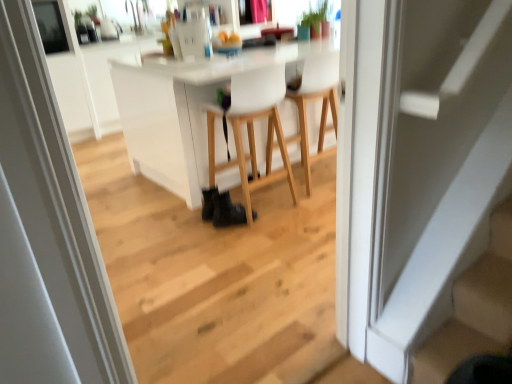
Find the location of a particular element. white matte chair at center, the second chair viewed from the right is located at coordinates (249, 142).

The image size is (512, 384). Describe the element at coordinates (47, 233) in the screenshot. I see `white glossy door at center` at that location.

Find the location of a particular element. The image size is (512, 384). white glossy door at center is located at coordinates (47, 233).

You are a GUI agent. You are given a task and a screenshot of the screen. Output one action in this format:
    pyautogui.click(x=<x>, y=<y>)
    Task: Click on the white matte chair at center, acting as the second chair starting from the left
    Image resolution: width=512 pixels, height=384 pixels.
    Given the screenshot: What is the action you would take?
    pyautogui.click(x=322, y=106)

The height and width of the screenshot is (384, 512). Describe the element at coordinates (474, 308) in the screenshot. I see `white matte stair at lower right` at that location.

In order to click on white matte chair at center, the second chair viewed from the right in this screenshot , I will do `click(249, 142)`.

Does point (0, 134) appear closer or farther from the camera than point (325, 98)?

Clearly, point (0, 134) is closer to the camera than point (325, 98).

Who is taller, white glossy door at center or white matte chair at center, placed as the first chair when sorted from right to left?

white glossy door at center is taller.

Would you say white glossy door at center is a long distance from white matte chair at center, acting as the second chair starting from the left?

Yes, white glossy door at center and white matte chair at center, acting as the second chair starting from the left, are quite far apart.

Who is shorter, white matte chair at center, the second chair viewed from the right, or white glossy door at center?

Standing shorter between the two is white matte chair at center, the second chair viewed from the right.

Considering the positions of objects white matte chair at center, the second chair viewed from the right, and white glossy door at center in the image provided, who is more to the right, white matte chair at center, the second chair viewed from the right, or white glossy door at center?

From the viewer's perspective, white matte chair at center, the second chair viewed from the right, appears more on the right side.

Considering the relative positions of white matte chair at center, the 1th chair positioned from the left, and white glossy door at center in the image provided, is white matte chair at center, the 1th chair positioned from the left, behind white glossy door at center?

That is True.

Between white matte chair at center, the second chair viewed from the right, and white glossy door at center, which one has smaller size?

white glossy door at center is smaller.

Is white matte chair at center, the second chair viewed from the right, outside of black leather shoe at lower center?

Indeed, white matte chair at center, the second chair viewed from the right, is completely outside black leather shoe at lower center.

Which is behind, point (257, 82) or point (212, 191)?

Point (212, 191)

Are white matte chair at center, the second chair viewed from the right, and black leather shoe at lower center far apart?

white matte chair at center, the second chair viewed from the right, is near black leather shoe at lower center, not far away.

Is white matte chair at center, the second chair viewed from the right, oriented towards black leather shoe at lower center?

No, white matte chair at center, the second chair viewed from the right, is not facing towards black leather shoe at lower center.

Who is smaller, white matte chair at center, acting as the second chair starting from the left, or white matte chair at center, the second chair viewed from the right?

white matte chair at center, acting as the second chair starting from the left.

Measure the distance from white matte chair at center, acting as the second chair starting from the left, to white matte chair at center, the 1th chair positioned from the left.

15.55 inches.

Is white matte chair at center, placed as the first chair when sorted from right to left, further to the viewer compared to white matte chair at center, the 1th chair positioned from the left?

Yes, white matte chair at center, placed as the first chair when sorted from right to left, is further from the viewer.

Consider the image. Does white matte chair at center, placed as the first chair when sorted from right to left, turn towards white matte chair at center, the 1th chair positioned from the left?

No, white matte chair at center, placed as the first chair when sorted from right to left, is not aimed at white matte chair at center, the 1th chair positioned from the left.

How much distance is there between white glossy door at center and white matte chair at center, the second chair viewed from the right?

The distance of white glossy door at center from white matte chair at center, the second chair viewed from the right, is 1.68 meters.

Is white matte chair at center, the 1th chair positioned from the left, completely or partially inside white glossy door at center?

Actually, white matte chair at center, the 1th chair positioned from the left, is outside white glossy door at center.

Considering the relative positions of white glossy door at center and white matte chair at center, the second chair viewed from the right, in the image provided, is white glossy door at center to the left or to the right of white matte chair at center, the second chair viewed from the right,?

From the image, it's evident that white glossy door at center is to the left of white matte chair at center, the second chair viewed from the right.

Looking at this image, from a real-world perspective, is white matte stair at lower right above or below white glossy door at center?

In terms of real-world spatial position, white matte stair at lower right is below white glossy door at center.

Which of these two, white matte stair at lower right or white glossy door at center, is smaller?

white matte stair at lower right is smaller.

Does white matte stair at lower right appear on the left side of white glossy door at center?

In fact, white matte stair at lower right is to the right of white glossy door at center.

Is white matte chair at center, the second chair viewed from the right, at the left side of white matte chair at center, placed as the first chair when sorted from right to left?

Correct, you'll find white matte chair at center, the second chair viewed from the right, to the left of white matte chair at center, placed as the first chair when sorted from right to left.

Is white matte chair at center, the second chair viewed from the right, facing away from white matte chair at center, acting as the second chair starting from the left?

That's not correct — white matte chair at center, the second chair viewed from the right, is not looking away from white matte chair at center, acting as the second chair starting from the left.

Would you say white matte chair at center, the 1th chair positioned from the left, is a long distance from white matte chair at center, placed as the first chair when sorted from right to left?

white matte chair at center, the 1th chair positioned from the left, is actually quite close to white matte chair at center, placed as the first chair when sorted from right to left.

How far apart are white matte chair at center, the second chair viewed from the right, and white matte chair at center, acting as the second chair starting from the left?

A distance of 15.55 inches exists between white matte chair at center, the second chair viewed from the right, and white matte chair at center, acting as the second chair starting from the left.

The image size is (512, 384). What are the coordinates of `screen door below the white matte chair at center, placed as the first chair when sorted from right to left (from the image's perspective)` in the screenshot? It's located at (47, 233).

The width and height of the screenshot is (512, 384). In order to click on screen door to the left of white matte chair at center, the second chair viewed from the right in this screenshot , I will do `click(47, 233)`.

Based on their spatial positions, is white matte stair at lower right or white matte chair at center, the second chair viewed from the right, closer to white glossy door at center?

white matte stair at lower right lies closer to white glossy door at center than the other object.

From the image, which object appears to be farther from white matte chair at center, the 1th chair positioned from the left, black leather shoe at lower center or white glossy door at center?

Based on the image, white glossy door at center appears to be further to white matte chair at center, the 1th chair positioned from the left.

From the image, which object appears to be farther from white matte chair at center, acting as the second chair starting from the left, white matte chair at center, the 1th chair positioned from the left, or white glossy door at center?

white glossy door at center is further to white matte chair at center, acting as the second chair starting from the left.

Considering their positions, is black leather shoe at lower center positioned closer to white matte chair at center, acting as the second chair starting from the left, than white matte chair at center, the second chair viewed from the right?

white matte chair at center, the second chair viewed from the right, lies closer to white matte chair at center, acting as the second chair starting from the left, than the other object.

Based on their spatial positions, is white matte chair at center, the 1th chair positioned from the left, or white matte stair at lower right further from white glossy door at center?

white matte chair at center, the 1th chair positioned from the left, is further to white glossy door at center.

Based on the photo, based on their spatial positions, is white matte chair at center, the 1th chair positioned from the left, or black leather shoe at lower center further from white matte chair at center, acting as the second chair starting from the left?

black leather shoe at lower center lies further to white matte chair at center, acting as the second chair starting from the left, than the other object.

Based on their spatial positions, is white matte chair at center, acting as the second chair starting from the left, or black leather shoe at lower center closer to white matte chair at center, the 1th chair positioned from the left?

black leather shoe at lower center lies closer to white matte chair at center, the 1th chair positioned from the left, than the other object.

Which object lies nearer to the anchor point white matte chair at center, acting as the second chair starting from the left, black leather shoe at lower center or white glossy door at center?

The object closer to white matte chair at center, acting as the second chair starting from the left, is black leather shoe at lower center.

Find the location of `chair between white matte stair at lower right and white matte chair at center, placed as the first chair when sorted from right to left, from front to back`. chair between white matte stair at lower right and white matte chair at center, placed as the first chair when sorted from right to left, from front to back is located at coordinates (249, 142).

At what (x,y) coordinates should I click in order to perform the action: click on stairs positioned between white glossy door at center and white matte chair at center, the 1th chair positioned from the left, from near to far. Please return your answer as a coordinate pair (x, y). Looking at the image, I should click on (474, 308).

You are a GUI agent. You are given a task and a screenshot of the screen. Output one action in this format:
    pyautogui.click(x=<x>, y=<y>)
    Task: Click on the stairs between white glossy door at center and black leather shoe at lower center from front to back
    This screenshot has width=512, height=384.
    Given the screenshot: What is the action you would take?
    [474, 308]

Find the location of a particular element. This screenshot has height=384, width=512. chair between white matte chair at center, placed as the first chair when sorted from right to left, and black leather shoe at lower center, in the vertical direction is located at coordinates (249, 142).